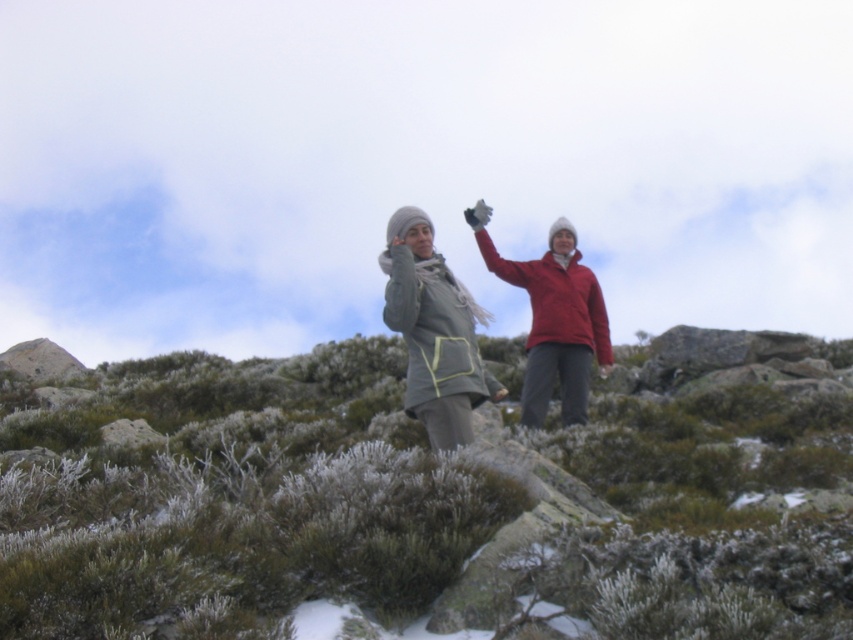
Question: Which point is closer to the camera?

Choices:
 (A) (814, 515)
 (B) (401, 301)

Answer: (A)

Question: Can you confirm if green mossy rocks at center is thinner than matte gray jacket at center?

Choices:
 (A) no
 (B) yes

Answer: (A)

Question: Is green mossy rocks at center to the left of matte gray jacket at center from the viewer's perspective?

Choices:
 (A) no
 (B) yes

Answer: (A)

Question: Is green mossy rocks at center below matte gray jacket at center?

Choices:
 (A) no
 (B) yes

Answer: (B)

Question: Which point is closer to the camera?

Choices:
 (A) (416, 308)
 (B) (241, 481)

Answer: (B)